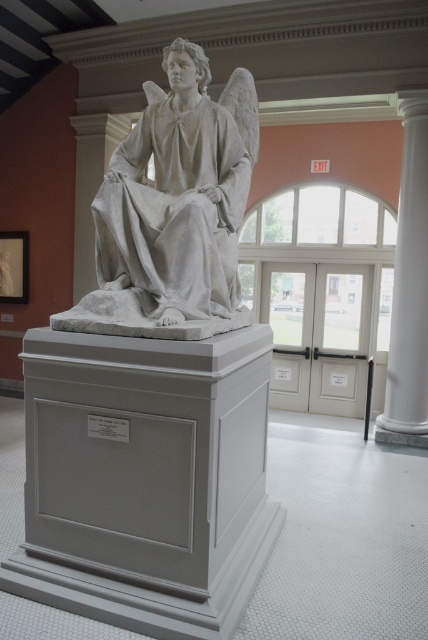
Question: Which of the following is the farthest from the observer?

Choices:
 (A) (403, 305)
 (B) (211, 214)
 (C) (234, 554)

Answer: (A)

Question: Which of the following is the farthest from the observer?

Choices:
 (A) (184, 269)
 (B) (235, 420)

Answer: (B)

Question: From the image, what is the correct spatial relationship of white marble statue at center in relation to white marble column at right?

Choices:
 (A) right
 (B) left

Answer: (B)

Question: Is white matte pedestal at center above white marble column at right?

Choices:
 (A) no
 (B) yes

Answer: (A)

Question: Which point is farther from the camera taking this photo?

Choices:
 (A) (213, 276)
 (B) (400, 307)

Answer: (B)

Question: Is white marble statue at center wider than white marble column at right?

Choices:
 (A) yes
 (B) no

Answer: (A)